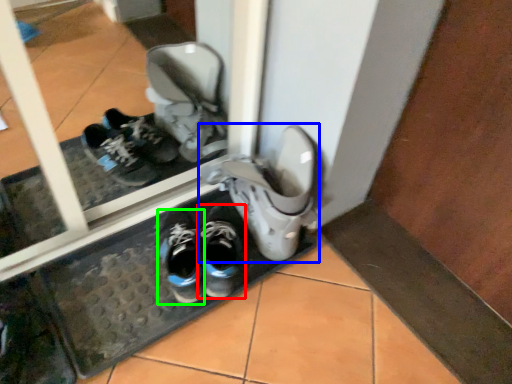
Question: Which object is the closest to the footwear (highlighted by a red box)? Choose among these: footwear (highlighted by a blue box) or running shoe (highlighted by a green box).

Choices:
 (A) footwear
 (B) running shoe

Answer: (B)